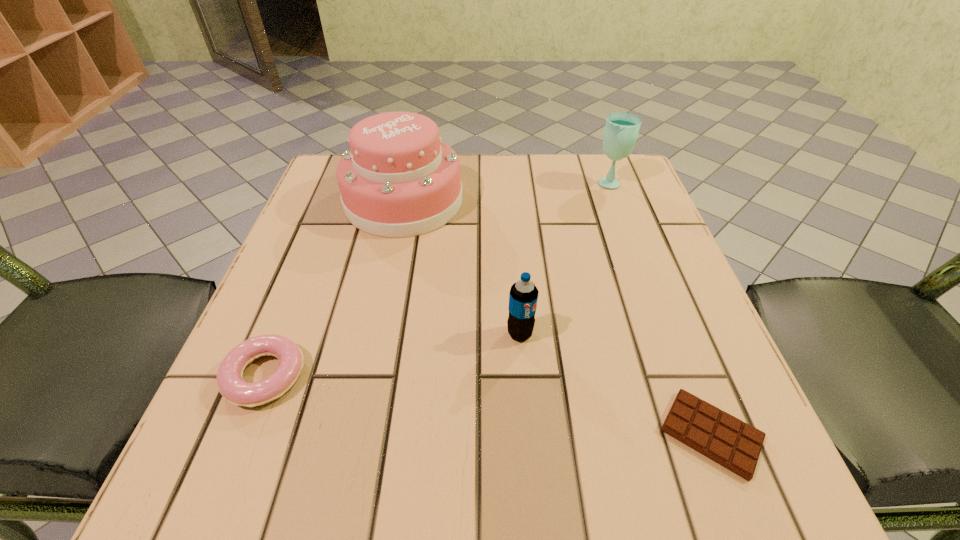
Locate an element on the screen. This screenshot has height=540, width=960. blank area located on the left of the candy bar is located at coordinates (477, 434).

The height and width of the screenshot is (540, 960). I want to click on cake positioned at the far edge, so click(x=399, y=179).

You are a GUI agent. You are given a task and a screenshot of the screen. Output one action in this format:
    pyautogui.click(x=<x>, y=<y>)
    Task: Click on the glass present at the far edge
    This screenshot has height=540, width=960.
    Given the screenshot: What is the action you would take?
    pyautogui.click(x=621, y=130)

Where is `object that is at the near edge`? This screenshot has height=540, width=960. object that is at the near edge is located at coordinates (730, 442).

Find the location of a particular element. The height and width of the screenshot is (540, 960). cake at the left edge is located at coordinates (399, 179).

Where is `doughnut that is at the left edge`? The image size is (960, 540). doughnut that is at the left edge is located at coordinates (233, 388).

Where is `glass that is at the right edge`? The image size is (960, 540). glass that is at the right edge is located at coordinates (621, 130).

Locate an element on the screen. The image size is (960, 540). candy bar at the right edge is located at coordinates (730, 442).

The image size is (960, 540). In order to click on object that is at the far left corner in this screenshot , I will do `click(399, 179)`.

The height and width of the screenshot is (540, 960). In order to click on object present at the far right corner in this screenshot , I will do `click(621, 130)`.